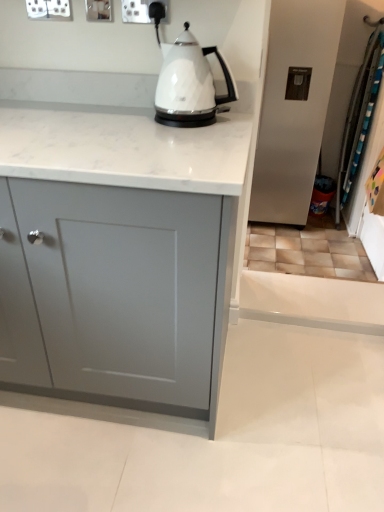
Question: Is white glossy kettle at center in front of or behind matte gray cabinet at center in the image?

Choices:
 (A) behind
 (B) front

Answer: (A)

Question: Considering the positions of white glossy kettle at center and matte gray cabinet at center in the image, is white glossy kettle at center bigger or smaller than matte gray cabinet at center?

Choices:
 (A) small
 (B) big

Answer: (A)

Question: Which object is the farthest from the white plastic socket at upper center?

Choices:
 (A) matte gray cabinet at center
 (B) white glossy kettle at center

Answer: (A)

Question: Which is nearer to the white plastic socket at upper center?

Choices:
 (A) matte gray cabinet at center
 (B) white glossy kettle at center

Answer: (B)